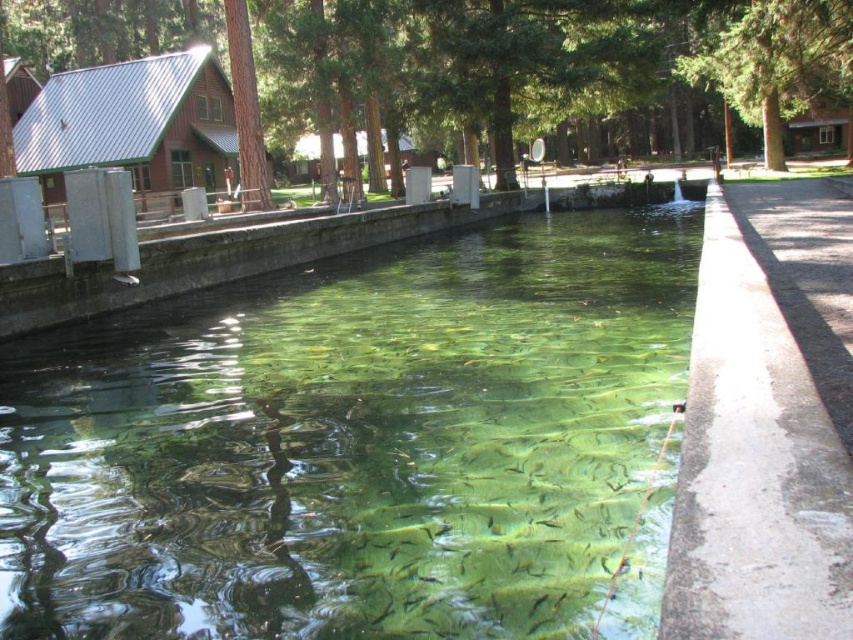
Between point (672, 17) and point (183, 76), which one is positioned in front?

Point (183, 76) is in front.

Can you confirm if green leafy tree at center is wider than metallic red cabin at left?

Indeed, green leafy tree at center has a greater width compared to metallic red cabin at left.

Who is more distant from viewer, (x=693, y=48) or (x=54, y=173)?

The point (x=693, y=48) is behind.

This screenshot has width=853, height=640. In order to click on green leafy tree at center in this screenshot , I will do `click(552, 60)`.

Who is more forward, (x=688, y=20) or (x=798, y=100)?

Point (x=798, y=100) is more forward.

Is green leafy tree at center above green textured tree at upper center?

Yes, green leafy tree at center is above green textured tree at upper center.

Is point (694, 10) closer to camera compared to point (763, 49)?

No, it is not.

Where is `green leafy tree at center`? The image size is (853, 640). green leafy tree at center is located at coordinates (552, 60).

Which of these two, clear glass water at center or metallic red cabin at left, stands shorter?

With less height is clear glass water at center.

The image size is (853, 640). What do you see at coordinates (352, 442) in the screenshot?
I see `clear glass water at center` at bounding box center [352, 442].

The height and width of the screenshot is (640, 853). What do you see at coordinates (352, 442) in the screenshot?
I see `clear glass water at center` at bounding box center [352, 442].

Locate an element on the screen. clear glass water at center is located at coordinates (352, 442).